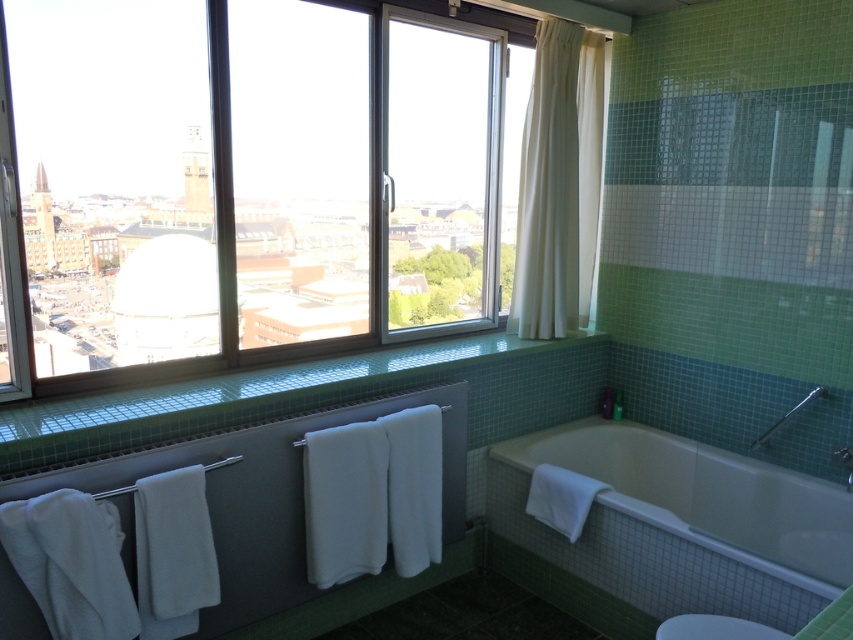
Question: Is white fabric curtain at upper right below white glossy toilet bowl at lower right?

Choices:
 (A) no
 (B) yes

Answer: (A)

Question: Estimate the real-world distances between objects in this image. Which object is farther from the white fabric curtain at upper right?

Choices:
 (A) white glossy bathtub at lower right
 (B) white glossy toilet bowl at lower right

Answer: (B)

Question: Among these objects, which one is nearest to the camera?

Choices:
 (A) clear glass window at upper left
 (B) satin nickel grab bar at upper right
 (C) white glossy bathtub at lower right

Answer: (C)

Question: Is clear glass window at upper left bigger than white glossy toilet bowl at lower right?

Choices:
 (A) no
 (B) yes

Answer: (B)

Question: Which point is farther from the camera taking this photo?

Choices:
 (A) (735, 632)
 (B) (782, 419)
 (C) (610, 448)

Answer: (C)

Question: Is white fabric curtain at upper right thinner than satin nickel grab bar at upper right?

Choices:
 (A) yes
 (B) no

Answer: (A)